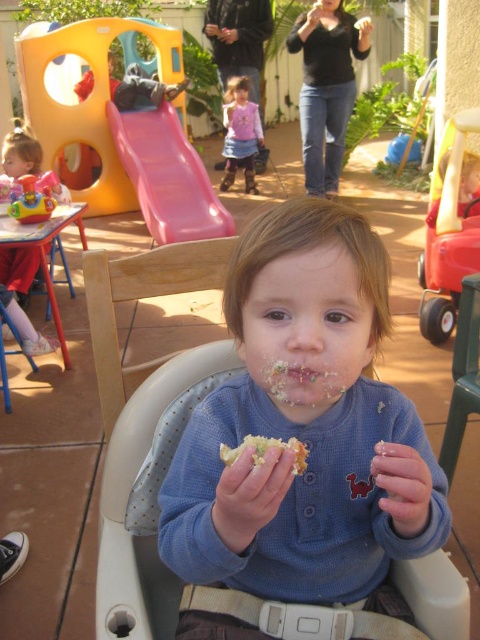
Question: Observing the image, what is the correct spatial positioning of blue soft shirt at center in reference to matte pink high chair at left?

Choices:
 (A) below
 (B) above

Answer: (A)

Question: Estimate the real-world distances between objects in this image. Which object is farther from the pink fabric dress at center?

Choices:
 (A) pink plastic slide at upper center
 (B) matte pink high chair at left
 (C) blue soft shirt at center

Answer: (C)

Question: Which point appears farthest from the camera in this image?

Choices:
 (A) (12, 278)
 (B) (262, 451)
 (C) (228, 99)
 (D) (347, 316)

Answer: (C)

Question: Can you confirm if pink plastic slide at upper center is smaller than matte pink high chair at left?

Choices:
 (A) no
 (B) yes

Answer: (A)

Question: Which of the following is the closest to the observer?

Choices:
 (A) blue soft shirt at center
 (B) pink plastic slide at upper center
 (C) pink fabric dress at center

Answer: (A)

Question: Is blue soft shirt at center wider than pink plastic slide at upper center?

Choices:
 (A) no
 (B) yes

Answer: (A)